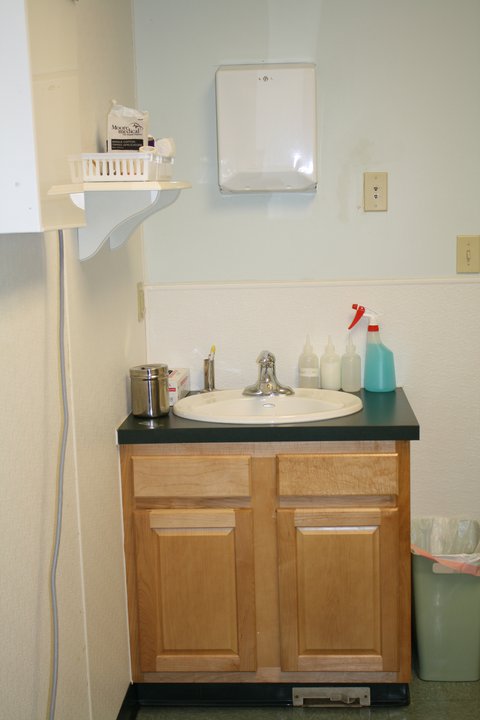
This screenshot has width=480, height=720. In order to click on door in this screenshot , I will do `click(215, 472)`.